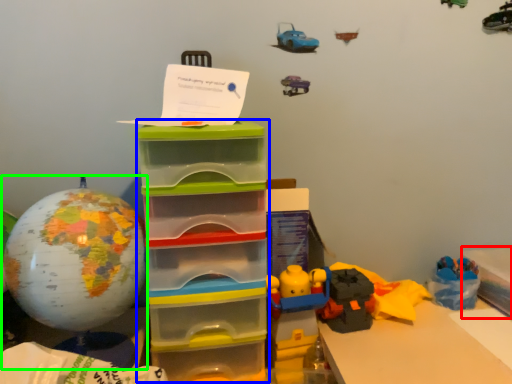
Question: Considering the real-world distances, which object is closest to storage box (highlighted by a red box)? storage box (highlighted by a blue box) or toy (highlighted by a green box).

Choices:
 (A) storage box
 (B) toy

Answer: (A)